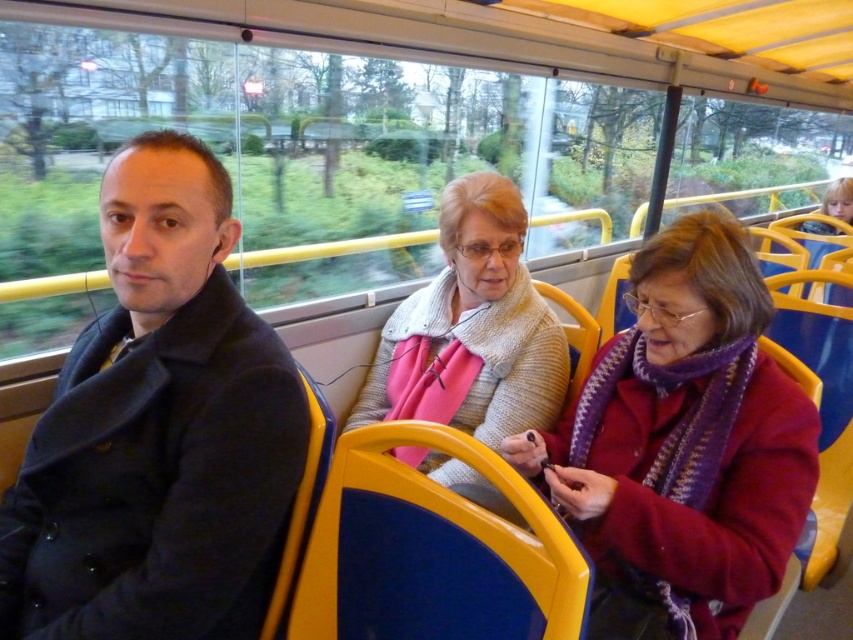
You are a passenger on a bus and want to place a rectangular box that is 20 cm wide on the seat next to you. The box must fit entirely within the space available. You see the matte black coat at left and the knitted purple scarf at center. Which object indicates the maximum width you can use to determine if the box will fit?

The matte black coat at left might be wider than knitted purple scarf at center, so you should use the width of the knitted purple scarf at center to determine if the 20 cm box will fit, as it is the narrower of the two.

You are a photographer trying to capture a photo of the matte black coat at left and the knitted sweater at center. Which object should you focus on first if you want to ensure both are in focus without adjusting your camera settings?

The matte black coat at left is much taller than the knitted sweater at center, so focusing on the matte black coat at left first will help ensure both are in focus since it is farther away.

What object is located at the coordinates point (x=158, y=429)?

The point (x=158, y=429) indicates the matte black coat at left.